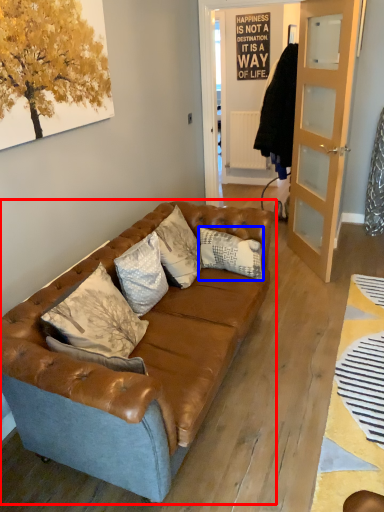
Question: Which object appears farthest to the camera in this image, studio couch (highlighted by a red box) or pillow (highlighted by a blue box)?

Choices:
 (A) studio couch
 (B) pillow

Answer: (B)